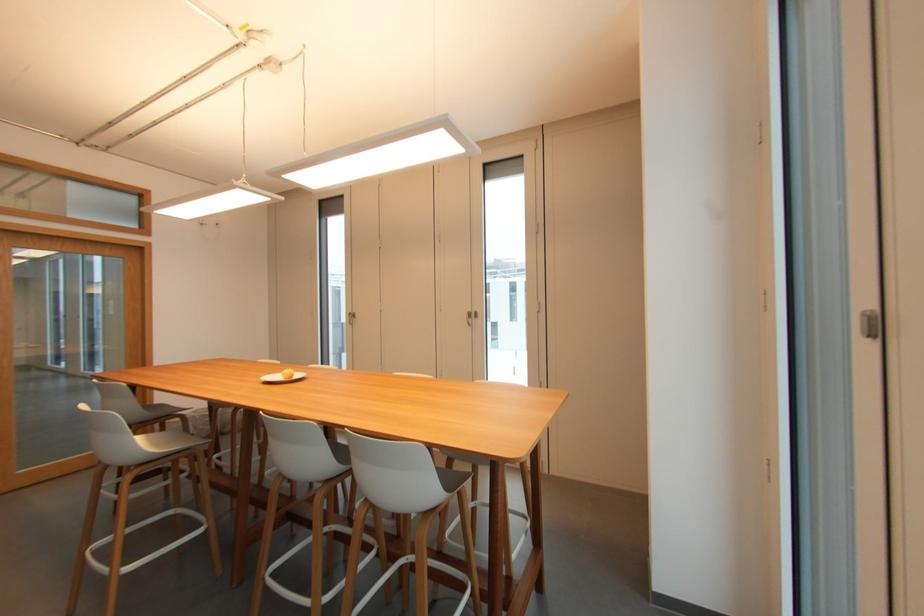
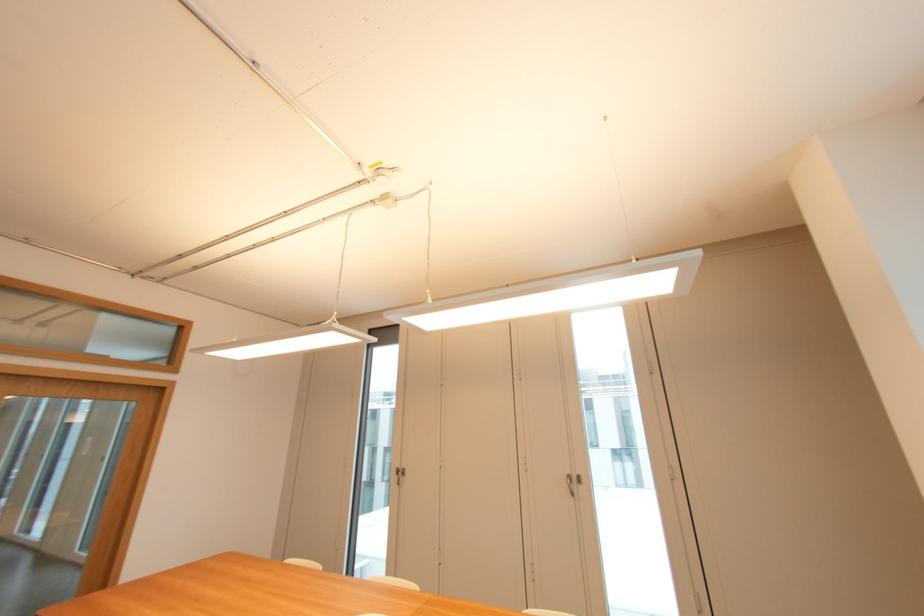
The point at (355, 315) is marked in the first image. Where is the corresponding point in the second image?

(405, 472)